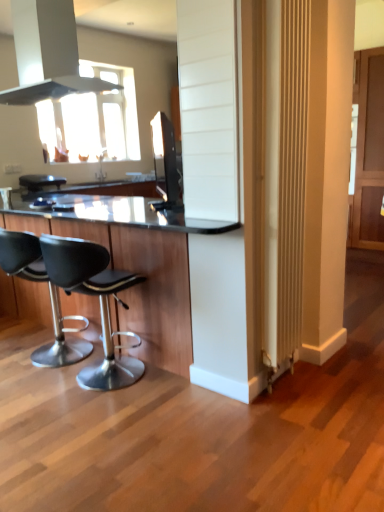
Question: Does black leather stool at left, positioned as the 1th chair in right-to-left order, have a lesser width compared to satin black tv at upper center?

Choices:
 (A) yes
 (B) no

Answer: (B)

Question: Can you confirm if black leather stool at left, positioned as the 1th chair in right-to-left order, is shorter than satin black tv at upper center?

Choices:
 (A) yes
 (B) no

Answer: (B)

Question: Is black leather stool at left, positioned as the 1th chair in right-to-left order, surrounding satin black tv at upper center?

Choices:
 (A) yes
 (B) no

Answer: (B)

Question: Is black leather stool at left, the second chair in the left-to-right sequence, behind satin black tv at upper center?

Choices:
 (A) yes
 (B) no

Answer: (B)

Question: Is black leather stool at left, the second chair in the left-to-right sequence, far away from satin black tv at upper center?

Choices:
 (A) yes
 (B) no

Answer: (A)

Question: Is black leather stool at left, positioned as the 1th chair in right-to-left order, wider than satin black tv at upper center?

Choices:
 (A) yes
 (B) no

Answer: (A)

Question: Is satin black tv at upper center smaller than black leather bar stool at center?

Choices:
 (A) yes
 (B) no

Answer: (B)

Question: Is the depth of satin black tv at upper center less than that of black leather bar stool at center?

Choices:
 (A) no
 (B) yes

Answer: (B)

Question: Does satin black tv at upper center have a larger size compared to black leather bar stool at center?

Choices:
 (A) yes
 (B) no

Answer: (A)

Question: Considering the relative sizes of satin black tv at upper center and black leather bar stool at center in the image provided, is satin black tv at upper center shorter than black leather bar stool at center?

Choices:
 (A) no
 (B) yes

Answer: (A)

Question: Is satin black tv at upper center at the left side of black leather bar stool at center?

Choices:
 (A) yes
 (B) no

Answer: (B)

Question: Considering the relative sizes of satin black tv at upper center and black leather bar stool at center in the image provided, is satin black tv at upper center thinner than black leather bar stool at center?

Choices:
 (A) no
 (B) yes

Answer: (B)

Question: Is black leather bar stool at center shorter than black leather stool at left, positioned as the 1th chair in right-to-left order?

Choices:
 (A) no
 (B) yes

Answer: (B)